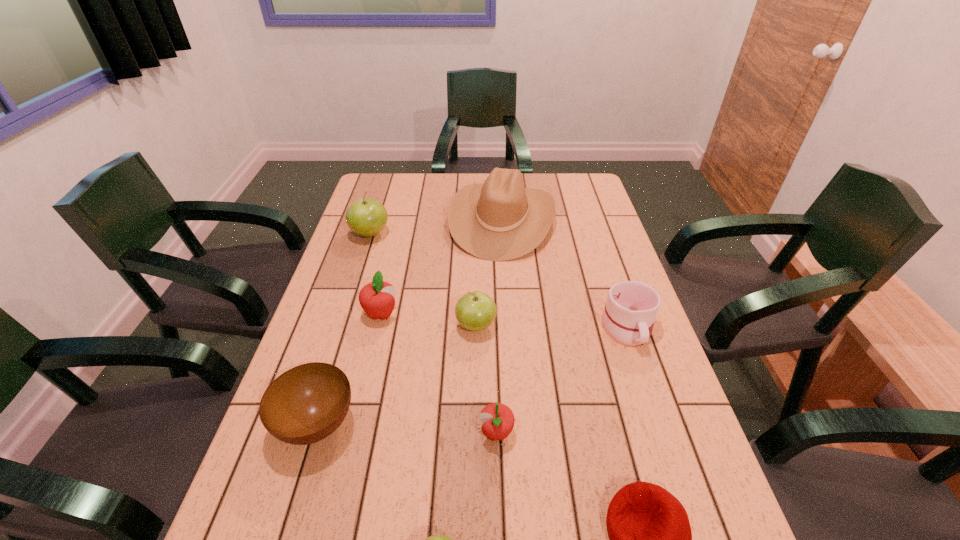
Where is `vacant area at the far edge`? The height and width of the screenshot is (540, 960). vacant area at the far edge is located at coordinates (419, 175).

The height and width of the screenshot is (540, 960). In order to click on vacant position at the left edge of the desktop in this screenshot , I will do `click(352, 264)`.

This screenshot has height=540, width=960. In the image, there is a desktop. What are the coordinates of `vacant space at the right edge` in the screenshot? It's located at (608, 405).

In the image, there is a desktop. Where is `blank space at the far left corner`? blank space at the far left corner is located at coordinates (370, 179).

The height and width of the screenshot is (540, 960). Identify the location of free spot between the nearer red apple and the farthest green apple. (433, 333).

This screenshot has height=540, width=960. Find the location of `free space between the cowboy hat and the bigger red apple`. free space between the cowboy hat and the bigger red apple is located at coordinates 442,267.

Find the location of a particular element. The height and width of the screenshot is (540, 960). free point between the second biggest green apple and the mug is located at coordinates (552, 327).

I want to click on free spot between the bowl and the second nearest green apple, so click(396, 375).

Locate an element on the screen. This screenshot has width=960, height=540. free spot between the farthest green apple and the bowl is located at coordinates (344, 329).

Choose which object is the seventh nearest neighbor to the left red apple. Please provide its 2D coordinates. Your answer should be formatted as a tuple, i.e. [(x, y)], where the tuple contains the x and y coordinates of a point satisfying the conditions above.

[(628, 317)]